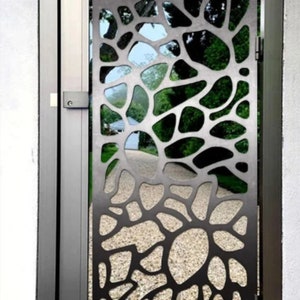
I want to click on decorative overlay, so point(210,73).